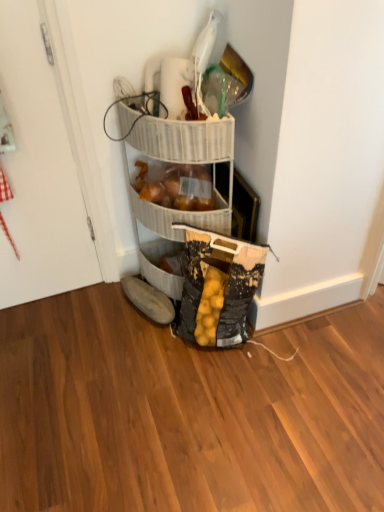
Question: Can you confirm if white glossy door at left is wider than brown suede shoe at lower center?

Choices:
 (A) yes
 (B) no

Answer: (B)

Question: From the image's perspective, would you say white glossy door at left is shown under brown suede shoe at lower center?

Choices:
 (A) yes
 (B) no

Answer: (B)

Question: Is white glossy door at left looking in the opposite direction of brown suede shoe at lower center?

Choices:
 (A) yes
 (B) no

Answer: (B)

Question: Can you confirm if white glossy door at left is thinner than brown suede shoe at lower center?

Choices:
 (A) no
 (B) yes

Answer: (B)

Question: Does white glossy door at left turn towards brown suede shoe at lower center?

Choices:
 (A) no
 (B) yes

Answer: (A)

Question: Is white glossy door at left to the left of brown suede shoe at lower center from the viewer's perspective?

Choices:
 (A) no
 (B) yes

Answer: (B)

Question: Is translucent plastic bag of onions at center positioned before brown suede shoe at lower center?

Choices:
 (A) no
 (B) yes

Answer: (B)

Question: Considering the relative sizes of translucent plastic bag of onions at center and brown suede shoe at lower center in the image provided, is translucent plastic bag of onions at center bigger than brown suede shoe at lower center?

Choices:
 (A) no
 (B) yes

Answer: (B)

Question: Is translucent plastic bag of onions at center oriented away from brown suede shoe at lower center?

Choices:
 (A) yes
 (B) no

Answer: (B)

Question: Is translucent plastic bag of onions at center aimed at brown suede shoe at lower center?

Choices:
 (A) yes
 (B) no

Answer: (B)

Question: Can you confirm if translucent plastic bag of onions at center is positioned to the left of brown suede shoe at lower center?

Choices:
 (A) yes
 (B) no

Answer: (B)

Question: Considering the relative sizes of translucent plastic bag of onions at center and brown suede shoe at lower center in the image provided, is translucent plastic bag of onions at center taller than brown suede shoe at lower center?

Choices:
 (A) no
 (B) yes

Answer: (B)

Question: Is white glossy door at left at the left side of translucent plastic bag of onions at center?

Choices:
 (A) no
 (B) yes

Answer: (B)